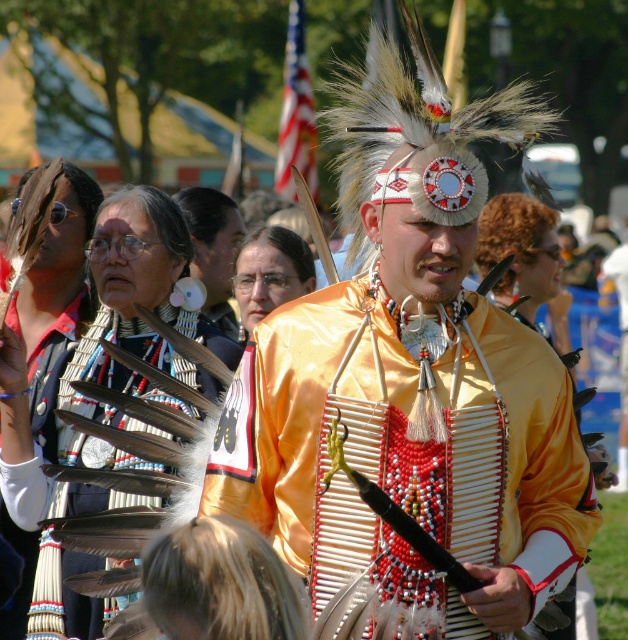
You are standing in the middle of the cultural event and see two points in the scene. The first point is at coordinate point (398, 378) and the second is at point (207, 372). Which point is closer to you?

Point (398, 378) is closer to the viewer than point (207, 372) according to the description.

You are standing at the event and want to take a photo of the satin yellow vest at center. If your camera has a maximum focus range of 10 meters, will you be able to capture the vest clearly?

The satin yellow vest at center is 12.73 meters away from the viewer. Since the camera can only focus up to 10 meters, it won t be able to capture the vest clearly at that distance.

From the picture: You are attending a cultural event and notice two items worn by the central figure. The first is the satin yellow vest at center, and the second is the matte black feather at center. Which of these items is positioned higher on the person?

The satin yellow vest at center is taller than the matte black feather at center, so the satin yellow vest at center is positioned higher on the person.